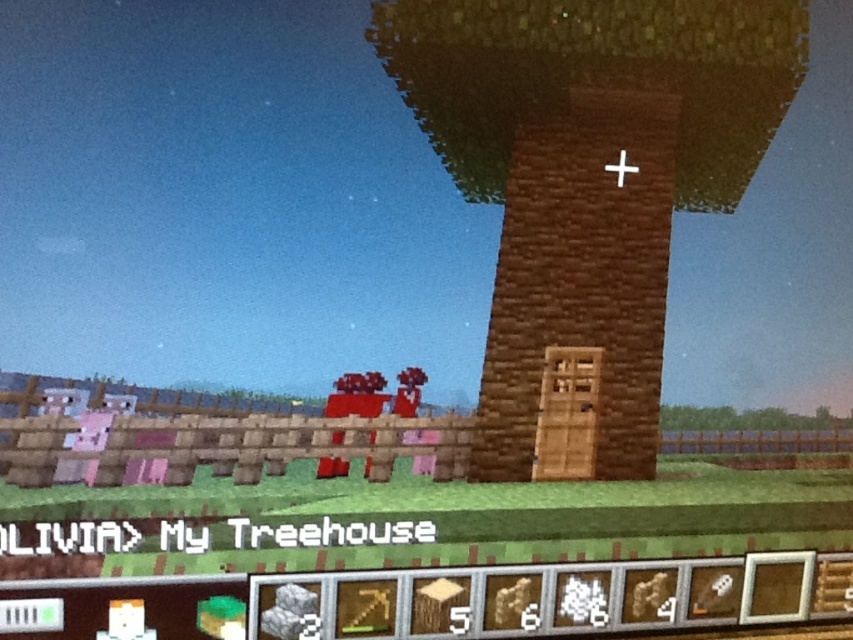
Can you confirm if brown wooden tower at center is smaller than white wooden cross at upper center?

No.

Does brown wooden tower at center appear over white wooden cross at upper center?

No.

Between point (485, 152) and point (618, 179), which one is positioned behind?

The point (485, 152) is more distant.

The height and width of the screenshot is (640, 853). Identify the location of brown wooden tower at center. click(589, 173).